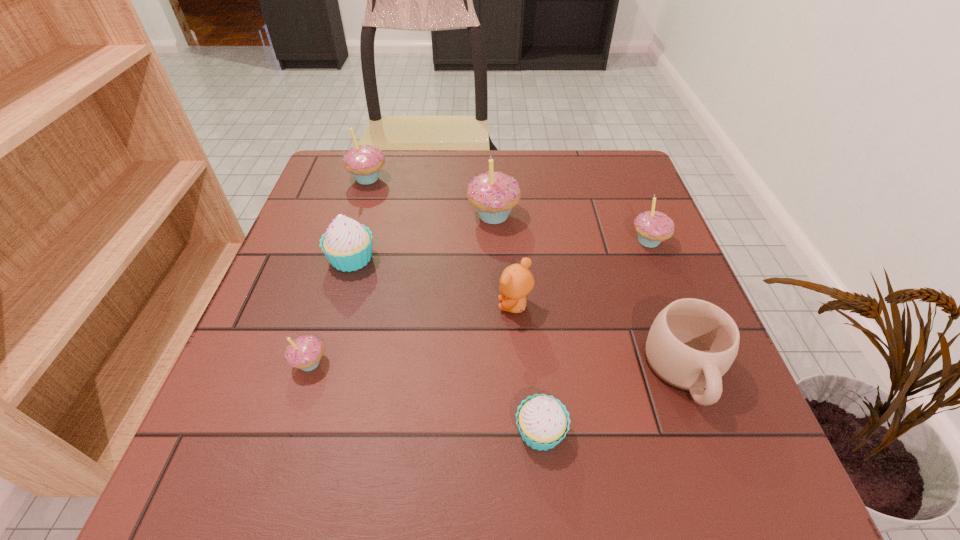
Where is `unoccupied position between the smaller white cupcake and the farther white cupcake`? unoccupied position between the smaller white cupcake and the farther white cupcake is located at coordinates (446, 345).

The image size is (960, 540). I want to click on free point between the tallest cupcake and the nearer white cupcake, so click(x=516, y=323).

The height and width of the screenshot is (540, 960). Find the location of `empty location between the biggest pink cupcake and the right white cupcake`. empty location between the biggest pink cupcake and the right white cupcake is located at coordinates (516, 323).

Find the location of `vacant space in between the tallest object and the rightmost cupcake`. vacant space in between the tallest object and the rightmost cupcake is located at coordinates (571, 228).

Where is `unoccupied area between the biggest pink cupcake and the farthest cupcake`? This screenshot has width=960, height=540. unoccupied area between the biggest pink cupcake and the farthest cupcake is located at coordinates (430, 197).

At what (x,y) coordinates should I click in order to perform the action: click on object that stands as the closest to the mug. Please return your answer as a coordinate pair (x, y). The image size is (960, 540). Looking at the image, I should click on [542, 421].

I want to click on object that is the third closest to the second smallest pink cupcake, so click(x=516, y=281).

Identify the location of cupcake that is the second closest to the smaller white cupcake. The image size is (960, 540). (347, 244).

Identify the location of the sixth closest cupcake to the mug. The width and height of the screenshot is (960, 540). (364, 162).

What are the coordinates of `pink cupcake that is the third closest one to the farthest pink cupcake` in the screenshot? It's located at (653, 227).